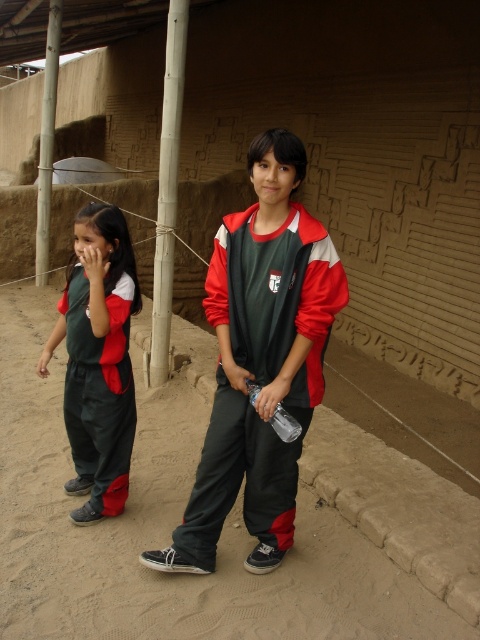
Who is positioned more to the right, dark gray sand at center or clear plastic bottle at center?

clear plastic bottle at center

Does point (193, 582) come behind point (248, 380)?

Yes, it is behind point (248, 380).

What do you see at coordinates (225, 524) in the screenshot? I see `dark gray sand at center` at bounding box center [225, 524].

Identify the location of dark gray sand at center. This screenshot has height=640, width=480. (225, 524).

Does matte green uniform at left have a smaller size compared to clear plastic bottle at center?

Actually, matte green uniform at left might be larger than clear plastic bottle at center.

Does matte green uniform at left appear on the left side of clear plastic bottle at center?

Yes, matte green uniform at left is to the left of clear plastic bottle at center.

Is point (103, 273) positioned after point (285, 424)?

Yes.

The width and height of the screenshot is (480, 640). Identify the location of matte green uniform at left. (97, 358).

Does dark gray sand at center appear under matte green uniform at left?

Yes.

Can you confirm if dark gray sand at center is positioned to the left of matte green uniform at left?

In fact, dark gray sand at center is to the right of matte green uniform at left.

Is point (433, 500) positioned before point (108, 308)?

No, it is not.

Find the location of a particular element. dark gray sand at center is located at coordinates (x=225, y=524).